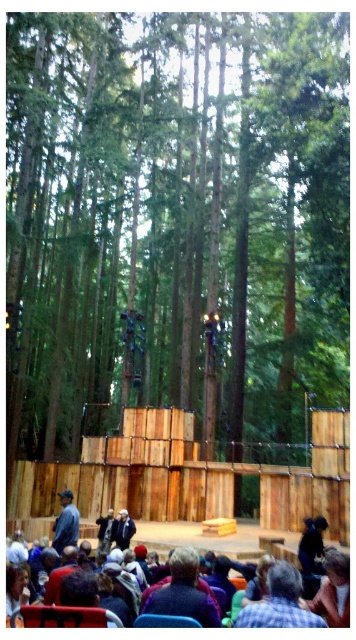
Question: Considering the real-world distances, which object is farthest from the dark blue sweater at lower center?

Choices:
 (A) dark blue shirt at lower left
 (B) light brown leather jacket at lower center
 (C) plaid shirt at lower center
 (D) dark gray fabric crowd at lower center

Answer: (D)

Question: Is plaid shirt at lower center positioned behind dark blue shirt at lower left?

Choices:
 (A) yes
 (B) no

Answer: (B)

Question: Does dark gray fabric crowd at lower center appear on the right side of light brown leather jacket at lower center?

Choices:
 (A) yes
 (B) no

Answer: (A)

Question: Which object is the farthest from the dark blue sweater at lower center?

Choices:
 (A) brown wood tree at center
 (B) light brown leather jacket at lower center

Answer: (A)

Question: Which object appears farthest from the camera in this image?

Choices:
 (A) plaid shirt at lower center
 (B) dark blue sweater at lower center
 (C) dark blue shirt at lower left

Answer: (C)

Question: Is the position of dark gray fabric crowd at lower center more distant than that of dark blue sweater at lower center?

Choices:
 (A) no
 (B) yes

Answer: (B)